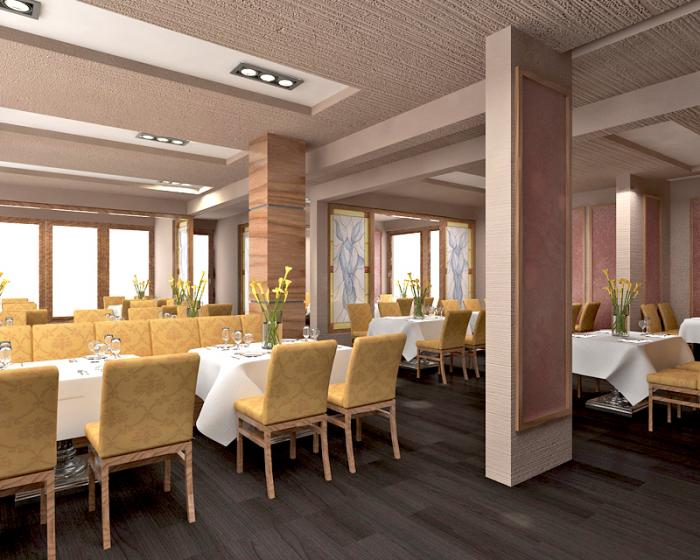
You are a GUI agent. You are given a task and a screenshot of the screen. Output one action in this format:
    pyautogui.click(x=<x>, y=<y>)
    Task: Click on the vase
    This screenshot has height=560, width=700.
    Given the screenshot: What is the action you would take?
    pyautogui.click(x=267, y=329), pyautogui.click(x=619, y=318), pyautogui.click(x=416, y=304), pyautogui.click(x=192, y=307), pyautogui.click(x=1, y=286), pyautogui.click(x=139, y=292)